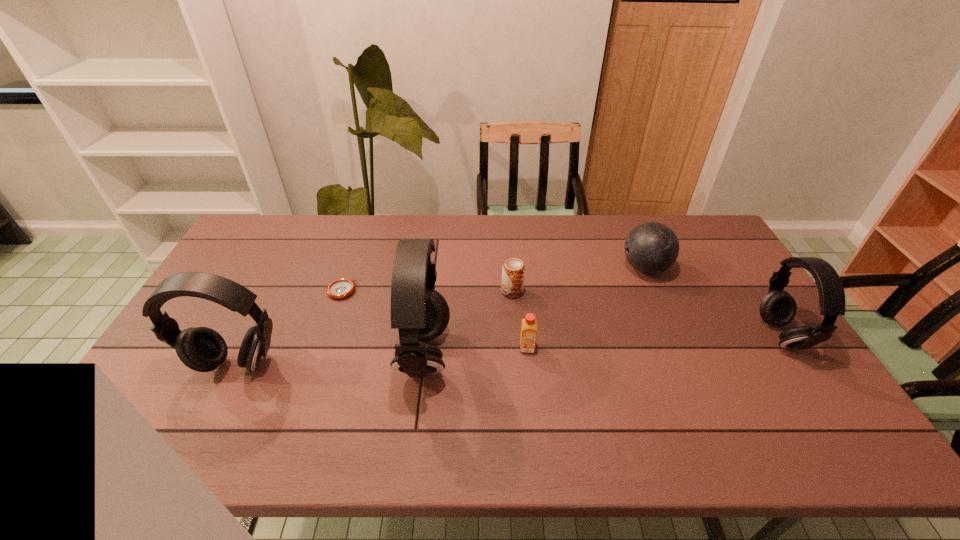
In order to click on the leftmost earphone in this screenshot , I will do `click(202, 349)`.

The image size is (960, 540). In order to click on the second tallest object in this screenshot , I will do `click(202, 349)`.

The height and width of the screenshot is (540, 960). What are the coordinates of `the fifth object from right to left` in the screenshot? It's located at click(420, 313).

Identify the location of the rightmost earphone. The height and width of the screenshot is (540, 960). (778, 308).

You are a GUI agent. You are given a task and a screenshot of the screen. Output one action in this format:
    pyautogui.click(x=<x>, y=<y>)
    Task: Click on the fifth shortest object
    This screenshot has height=540, width=960.
    Given the screenshot: What is the action you would take?
    pyautogui.click(x=778, y=308)

Find the location of a particular element. the second object from right to left is located at coordinates (651, 248).

At what (x,y) coordinates should I click in order to perform the action: click on bowling ball. Please return your answer as a coordinate pair (x, y). This screenshot has height=540, width=960. Looking at the image, I should click on (651, 248).

At what (x,y) coordinates should I click in order to perform the action: click on compass. Please return your answer as a coordinate pair (x, y). Looking at the image, I should click on (341, 288).

Identify the location of the sixth object from right to left. The image size is (960, 540). (341, 288).

This screenshot has width=960, height=540. Identify the location of beer can. (513, 271).